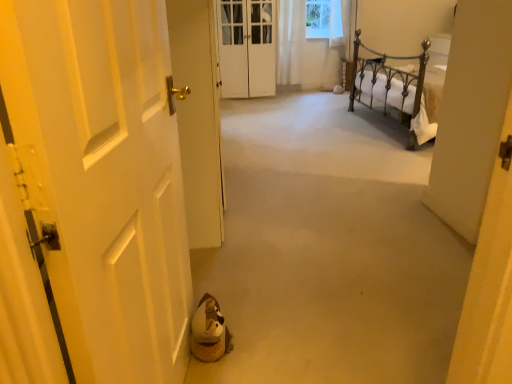
This screenshot has width=512, height=384. What are the coordinates of `vacant area located to the right-hand side of white glossy door at left, positioned as the second door in back-to-front order` in the screenshot? It's located at (329, 195).